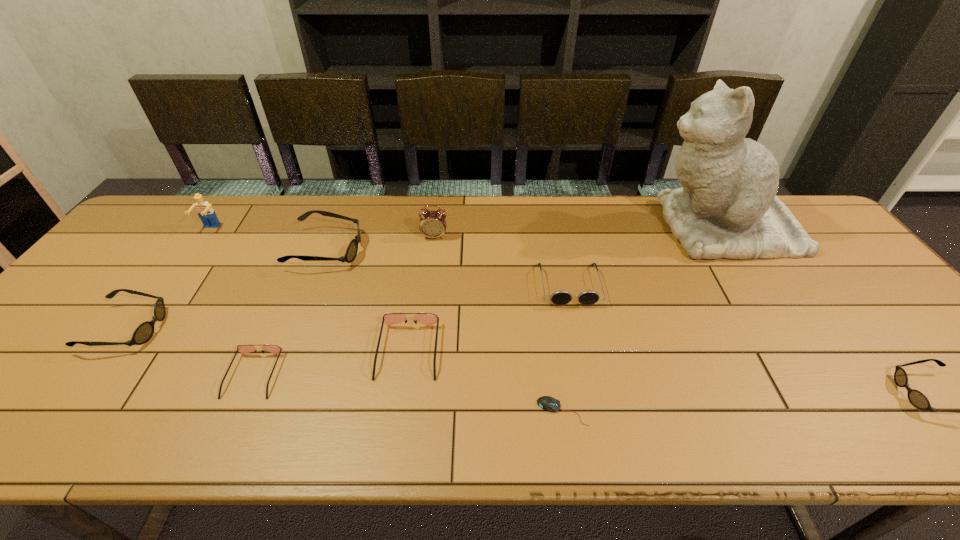
You are a GUI agent. You are given a task and a screenshot of the screen. Output one action in this format:
    pyautogui.click(x=<x>, y=<y>)
    Task: Click on the vacant space in between the Lego and the alarm clock
    
    Given the screenshot: What is the action you would take?
    pyautogui.click(x=323, y=233)

Where is `vacant area between the third sunglasses from right to left and the leftmost sunglasses`? The width and height of the screenshot is (960, 540). vacant area between the third sunglasses from right to left and the leftmost sunglasses is located at coordinates (268, 339).

Locate an element on the screen. The image size is (960, 540). vacant area between the blue Lego and the second black sunglasses from right to left is located at coordinates (269, 239).

This screenshot has width=960, height=540. I want to click on free space between the cat and the second sunglasses from right to left, so click(x=645, y=256).

The image size is (960, 540). In order to click on object that can be found as the eighth closest to the smaller pink sunglasses in this screenshot , I will do `click(727, 207)`.

Identify which object is the eighth closest to the leftmost sunglasses. Please provide its 2D coordinates. Your answer should be formatted as a tuple, i.e. [(x, y)], where the tuple contains the x and y coordinates of a point satisfying the conditions above.

[(727, 207)]

Choose which sunglasses is the fourth nearest neighbor to the black mouse. Please provide its 2D coordinates. Your answer should be formatted as a tuple, i.e. [(x, y)], where the tuple contains the x and y coordinates of a point satisfying the conditions above.

[(352, 249)]

Locate which sunglasses is the second closest to the biggest black sunglasses. Please provide its 2D coordinates. Your answer should be formatted as a tuple, i.e. [(x, y)], where the tuple contains the x and y coordinates of a point satisfying the conditions above.

[(144, 332)]

Where is `black sunglasses that stands as the closest to the tallest object`? black sunglasses that stands as the closest to the tallest object is located at coordinates (917, 399).

The width and height of the screenshot is (960, 540). Find the location of `black sunglasses that is the closest to the rightmost black sunglasses`. black sunglasses that is the closest to the rightmost black sunglasses is located at coordinates (352, 249).